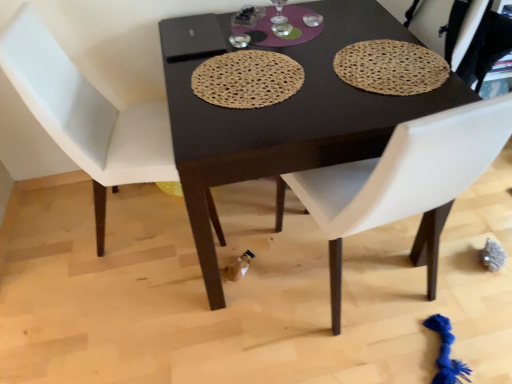
You are a GUI agent. You are given a task and a screenshot of the screen. Output one action in this format:
    pyautogui.click(x=<x>, y=<y>)
    Task: Click on the free space to the left of dark brown wood table at center
    Image resolution: width=512 pixels, height=384 pixels.
    Given the screenshot: What is the action you would take?
    pyautogui.click(x=89, y=280)